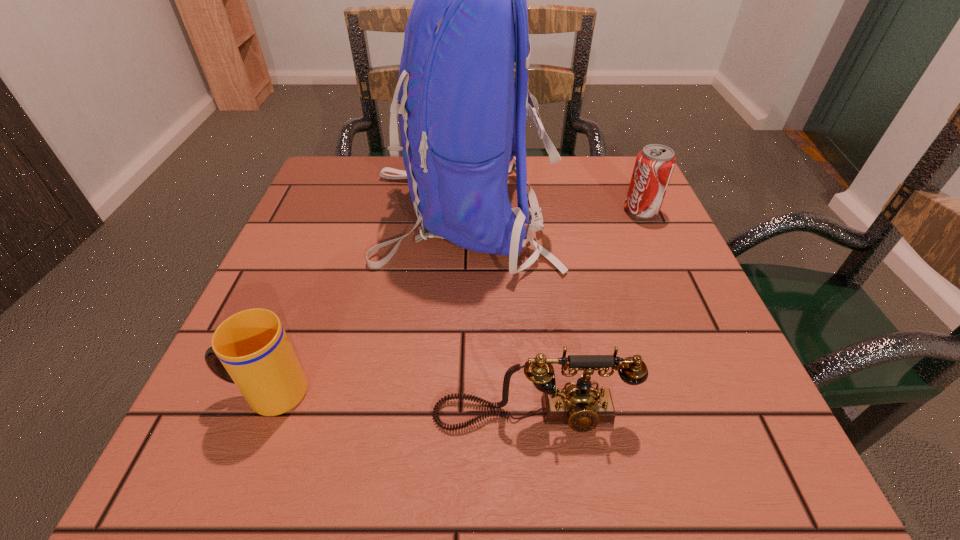
At what (x,y) coordinates should I click in order to perform the action: click on backpack. Please return your answer as a coordinate pair (x, y). Looking at the image, I should click on (462, 120).

In order to click on the rightmost object in this screenshot , I will do `click(654, 165)`.

This screenshot has height=540, width=960. I want to click on the leftmost object, so click(x=251, y=349).

Where is `telephone`? telephone is located at coordinates pos(581,406).

Locate an element on the screen. The image size is (960, 540). vacant space located 0.130m on the back of the backpack is located at coordinates (612, 213).

I want to click on free spot located on the front of the rightmost object, so coord(659,250).

Where is `vacant space located 0.050m on the front-facing side of the telephone`? This screenshot has width=960, height=540. vacant space located 0.050m on the front-facing side of the telephone is located at coordinates (538, 472).

Identify the location of backpack that is at the far edge. (462, 120).

Identify the location of soda can that is at the far edge. (654, 165).

The image size is (960, 540). In order to click on object that is at the near edge in this screenshot , I will do tap(581, 406).